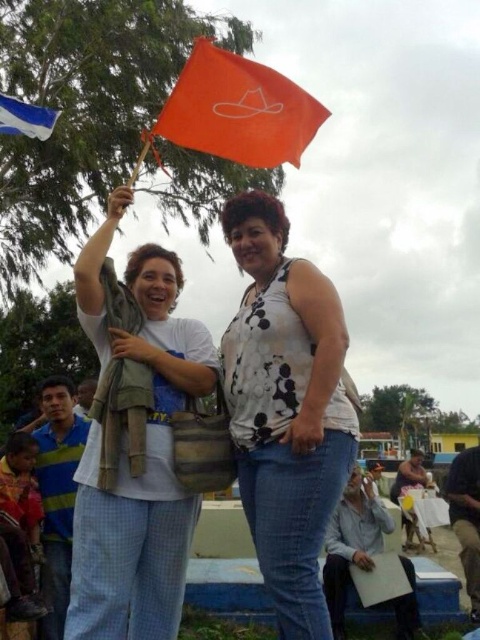
You are a photographer trying to capture a closeup shot of the white printed tank top at center and the blue fabric flag at upper left. Which object should you zoom in on to ensure both are in frame without moving the camera?

The white printed tank top at center is wider than the blue fabric flag at upper left, so you should zoom in on the white printed tank top at center to ensure both are in frame without moving the camera.